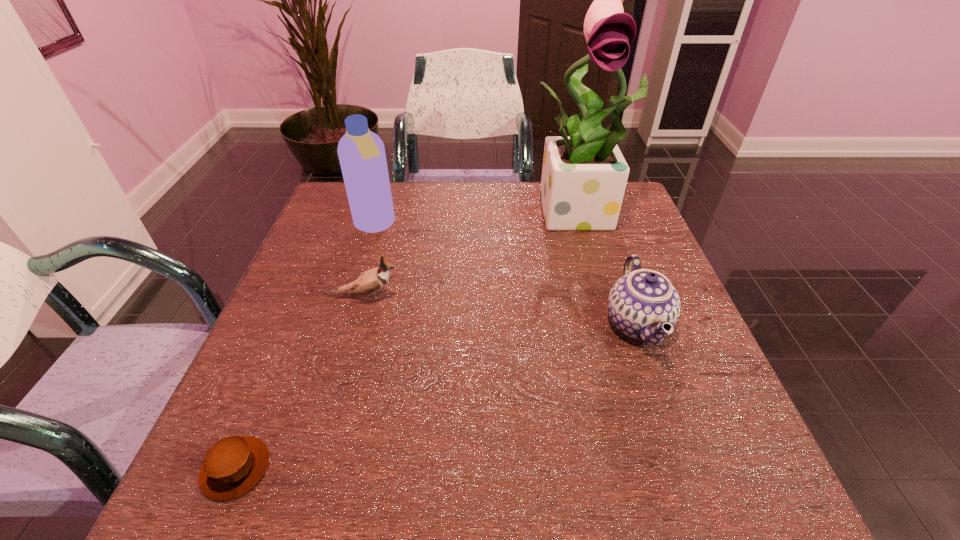
This screenshot has width=960, height=540. Find the location of `the tallest object`. the tallest object is located at coordinates (584, 175).

The width and height of the screenshot is (960, 540). Identify the location of shampoo. (361, 152).

You are a GUI agent. You are given a task and a screenshot of the screen. Output one action in this format:
    pyautogui.click(x=<x>, y=<y>)
    Task: Click on the chinaware
    The width and height of the screenshot is (960, 540).
    Given the screenshot: What is the action you would take?
    tap(643, 304)

The height and width of the screenshot is (540, 960). I want to click on bird, so click(x=372, y=280).

Find the location of a particular element. Image resolution: width=960 pixels, height=540 pixels. the shortest object is located at coordinates (234, 465).

Locate an element on the screen. The image size is (960, 540). muffin is located at coordinates (234, 465).

Find the location of a particular element. free location located on the front-facing side of the flower arrangement is located at coordinates (604, 280).

Locate an element on the screen. The image size is (960, 540). blank area located on the front of the shampoo is located at coordinates (345, 325).

This screenshot has height=540, width=960. I want to click on vacant space located at the spout of the chinaware, so click(529, 323).

You are a GUI agent. You are given a task and a screenshot of the screen. Output one action in this format:
    pyautogui.click(x=<x>, y=<y>)
    Task: Click on the vacant space located 0.180m at the spout of the chinaware
    
    Given the screenshot: What is the action you would take?
    pyautogui.click(x=519, y=323)